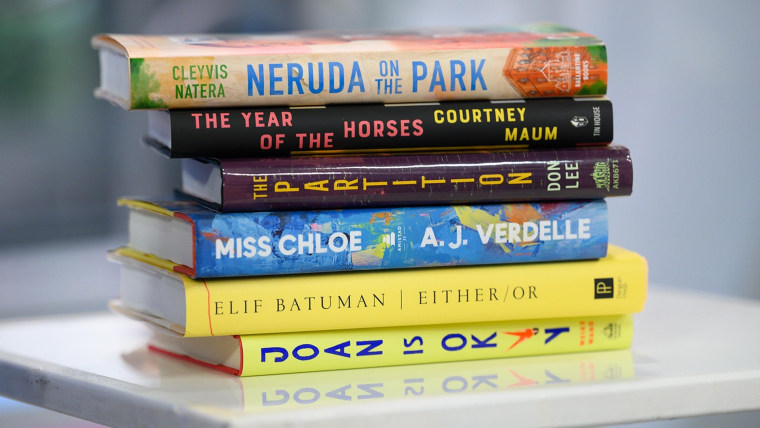
The height and width of the screenshot is (428, 760). What are the coordinates of `books` in the screenshot? It's located at (214, 83), (220, 133), (260, 192), (258, 247), (286, 309), (296, 364).